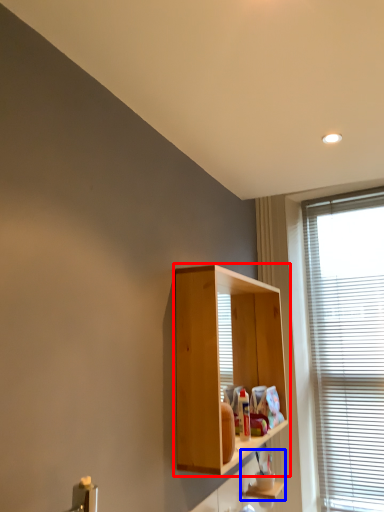
Question: Which object appears closest to the camera in this image, cabinetry (highlighted by a red box) or cabinet (highlighted by a blue box)?

Choices:
 (A) cabinetry
 (B) cabinet

Answer: (A)